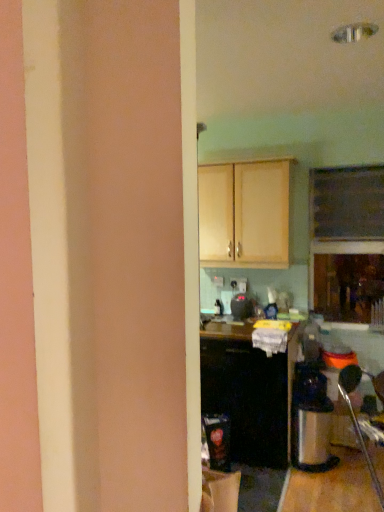
You are a GUI agent. You are given a task and a screenshot of the screen. Output one action in this format:
    pyautogui.click(x=<x>, y=<y>)
    Task: Click on the free space to the left of black plastic toaster at center
    Image resolution: width=384 pixels, height=512 pixels.
    Given the screenshot: What is the action you would take?
    tap(221, 316)